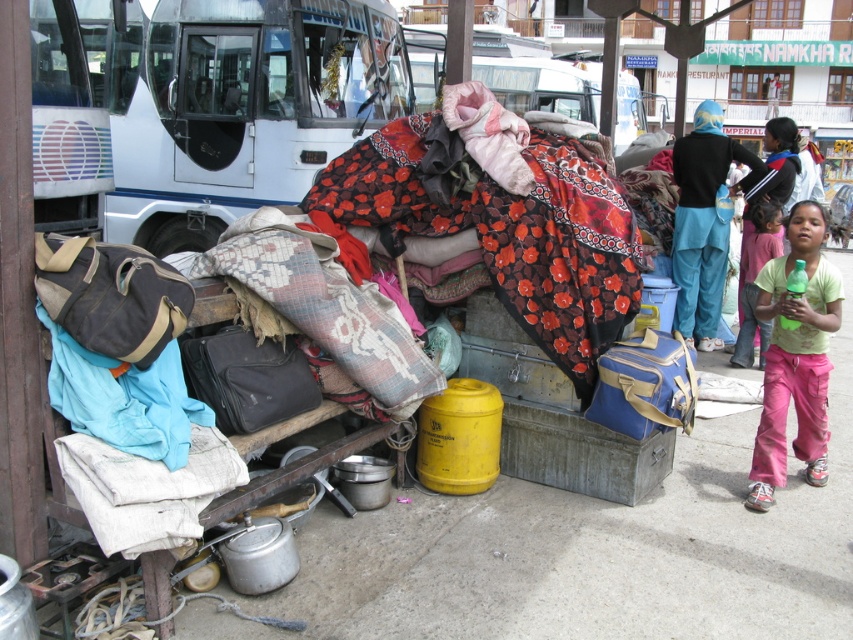
Describe the element at coordinates (65, 125) in the screenshot. The image size is (853, 640). I see `white plastic bus at upper left` at that location.

From the picture: Who is shorter, white plastic bus at upper left or brown canvas duffel at left?

brown canvas duffel at left is shorter.

Who is more distant from viewer, (77,77) or (96,320)?

Positioned behind is point (77,77).

Image resolution: width=853 pixels, height=640 pixels. I want to click on white plastic bus at upper left, so click(65, 125).

Does white glossy bus at upper left have a greater height compared to blue fabric pants at right?

Indeed, white glossy bus at upper left has a greater height compared to blue fabric pants at right.

Which is behind, point (165, 193) or point (706, 320)?

The point (165, 193) is behind.

The width and height of the screenshot is (853, 640). Find the location of `white glossy bus at upper left`. white glossy bus at upper left is located at coordinates (241, 108).

This screenshot has width=853, height=640. What are the coordinates of `white glossy bus at upper left` in the screenshot? It's located at (241, 108).

The image size is (853, 640). Describe the element at coordinates (111, 296) in the screenshot. I see `brown canvas duffel at left` at that location.

Between point (38, 280) and point (679, 417), which one is positioned behind?

Positioned behind is point (679, 417).

Find the location of a particular element. brown canvas duffel at left is located at coordinates pyautogui.click(x=111, y=296).